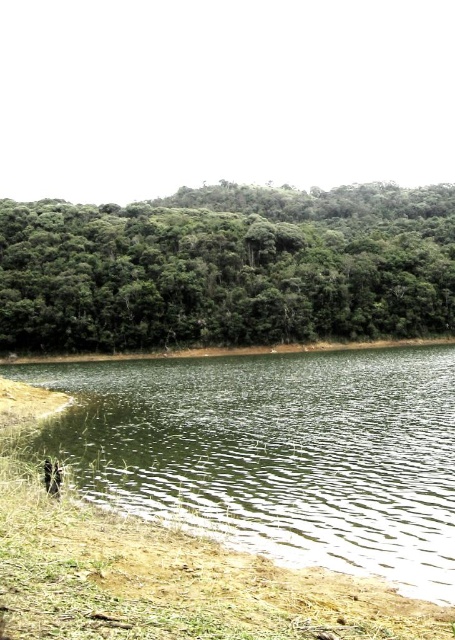
What do you see at coordinates (227, 268) in the screenshot?
I see `green leafy trees at upper center` at bounding box center [227, 268].

Who is more distant from viewer, [97,243] or [46,483]?

The point [97,243] is behind.

What are the coordinates of `green leafy trees at upper center` in the screenshot? It's located at (227, 268).

Between point (369, 534) and point (85, 275), which one is positioned behind?

The point (85, 275) is more distant.

Does green liquid water at lower center have a smaller size compared to green leafy trees at upper center?

Yes.

Who is more distant from viewer, (430,364) or (323,282)?

Positioned behind is point (323,282).

You are a GUI agent. You are given a task and a screenshot of the screen. Output one action in this format:
    pyautogui.click(x=<x>, y=<y>)
    Task: Click on the green liquid water at lower center
    The width and height of the screenshot is (455, 640).
    Given the screenshot: What is the action you would take?
    pyautogui.click(x=274, y=452)

Between green liquid water at lower center and brown fur animal at lower left, which one has less height?

Standing shorter between the two is brown fur animal at lower left.

What do you see at coordinates (274, 452) in the screenshot?
I see `green liquid water at lower center` at bounding box center [274, 452].

The width and height of the screenshot is (455, 640). What are the coordinates of `green liquid water at lower center` in the screenshot? It's located at (274, 452).